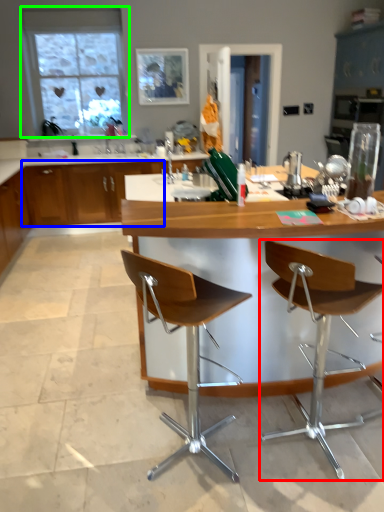
Question: Which is nearer to the chair (highlighted by a red box)? cabinetry (highlighted by a blue box) or window (highlighted by a green box).

Choices:
 (A) cabinetry
 (B) window

Answer: (A)